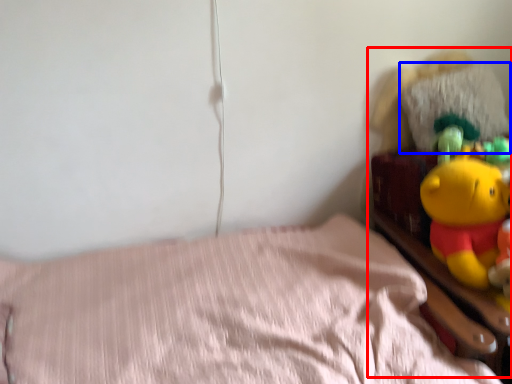
Question: Which object is closer to the camera taking this photo, toy (highlighted by a red box) or pillow (highlighted by a blue box)?

Choices:
 (A) toy
 (B) pillow

Answer: (A)